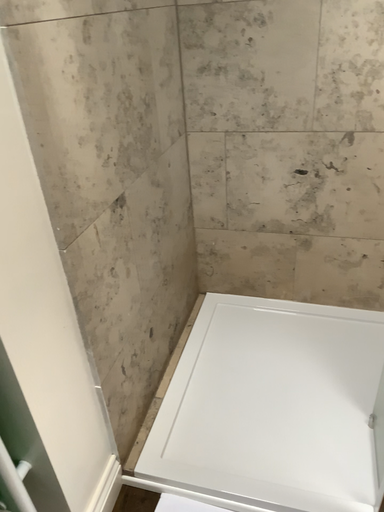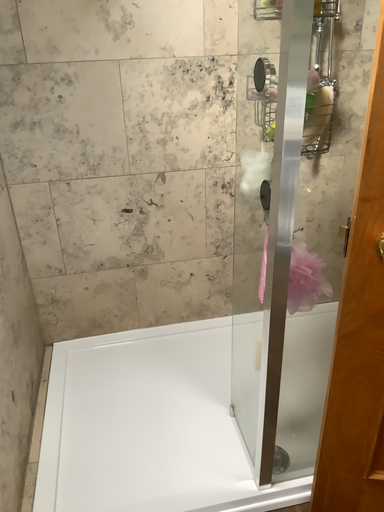
Question: How did the camera likely rotate when shooting the video?

Choices:
 (A) rotated left
 (B) rotated right

Answer: (B)